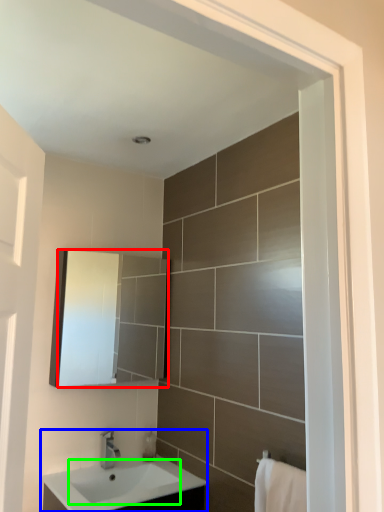
Question: Considering the real-world distances, which object is closest to mirror (highlighted by a red box)? sink (highlighted by a blue box) or sink (highlighted by a green box).

Choices:
 (A) sink
 (B) sink

Answer: (A)